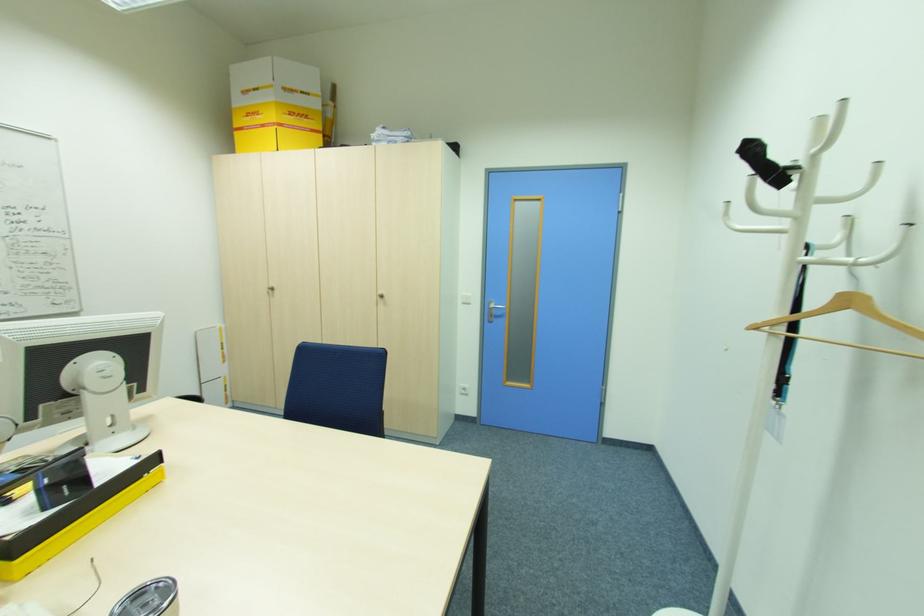
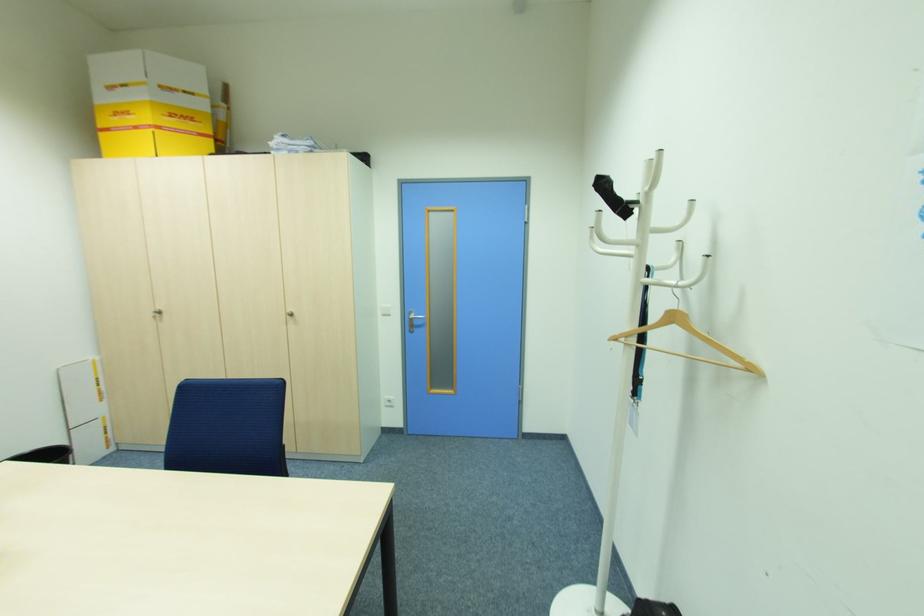
Find the pixel in the second image that matches the point at 274,290 in the first image.

(162, 312)